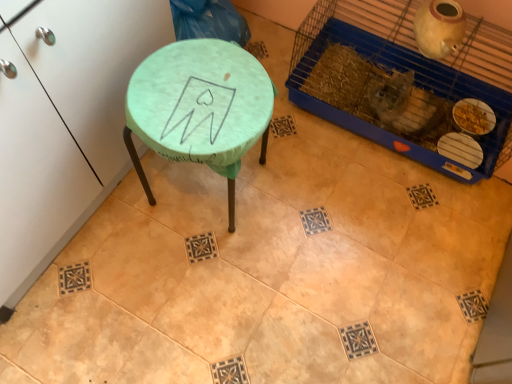
Where is `free spot below matte green stool at center (from a real-world perspective)`? This screenshot has width=512, height=384. free spot below matte green stool at center (from a real-world perspective) is located at coordinates (207, 192).